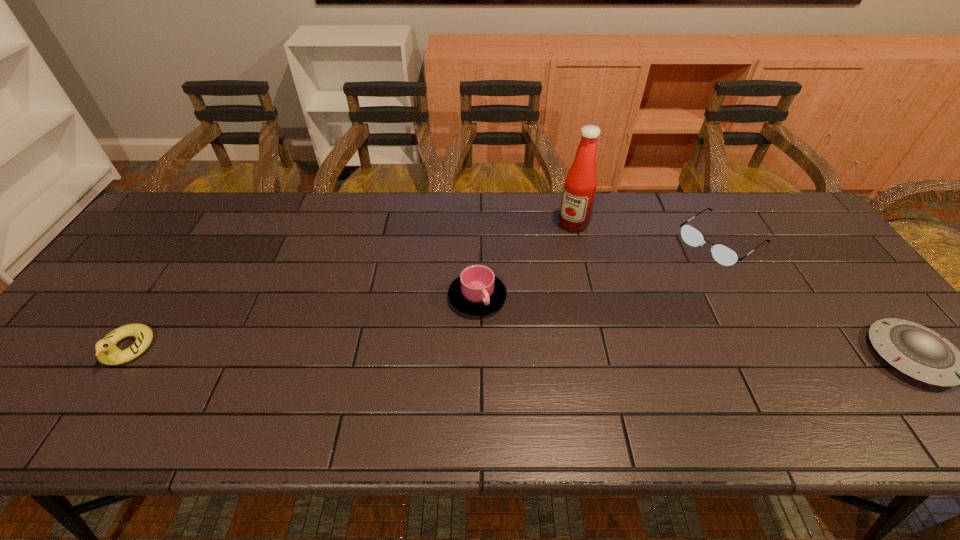
Identify the location of vacant area between the second object from left to right and the second object from right to left. The image size is (960, 540). (599, 269).

Identify the location of free spot between the duckling and the third nearest object. Image resolution: width=960 pixels, height=540 pixels. (302, 323).

The width and height of the screenshot is (960, 540). I want to click on free point between the fourth tallest object and the third object from right to left, so click(647, 232).

Locate an element on the screen. The height and width of the screenshot is (540, 960). vacant area that lies between the tallest object and the fourth object from left to right is located at coordinates (647, 232).

Locate which object ranks in proximity to the fourth object from left to right. Please provide its 2D coordinates. Your answer should be formatted as a tuple, i.e. [(x, y)], where the tuple contains the x and y coordinates of a point satisfying the conditions above.

[(915, 350)]

Locate which object is the second closest to the fourth object from left to right. Please provide its 2D coordinates. Your answer should be formatted as a tuple, i.e. [(x, y)], where the tuple contains the x and y coordinates of a point satisfying the conditions above.

[(580, 185)]